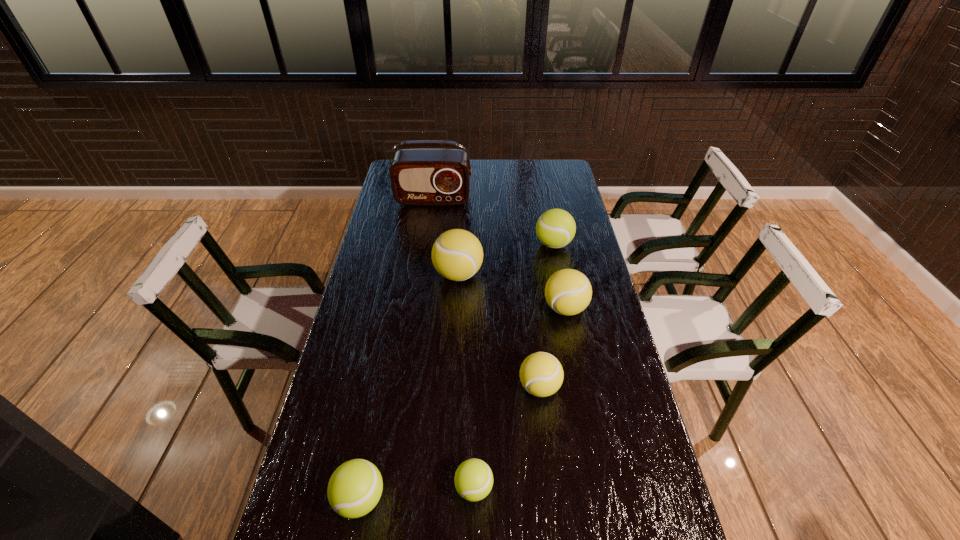
The height and width of the screenshot is (540, 960). In order to click on the leftmost green tennis ball in this screenshot , I will do `click(354, 489)`.

The width and height of the screenshot is (960, 540). I want to click on the second biggest green tennis ball, so click(x=354, y=489).

This screenshot has width=960, height=540. Find the location of `the shortest tennis ball`. the shortest tennis ball is located at coordinates (473, 480).

Where is `the second green tennis ball from left to right`? The height and width of the screenshot is (540, 960). the second green tennis ball from left to right is located at coordinates (473, 480).

The height and width of the screenshot is (540, 960). Identify the location of blank area located on the front panel of the tallest object. 430,223.

Identify the location of free space located on the right of the biggest yellow tennis ball. (556, 274).

Where is `free space located 0.360m on the back of the second farthest yellow tennis ball`? The image size is (960, 540). free space located 0.360m on the back of the second farthest yellow tennis ball is located at coordinates (550, 230).

Locate an element on the screen. Image resolution: width=960 pixels, height=540 pixels. free space located on the right of the farthest tennis ball is located at coordinates (591, 244).

This screenshot has width=960, height=540. Find the location of `free region located on the back of the fifth farthest object`. free region located on the back of the fifth farthest object is located at coordinates (528, 282).

What are the coordinates of `vacant space located 0.140m on the back of the leftmost green tennis ball` in the screenshot? It's located at pyautogui.click(x=375, y=420).